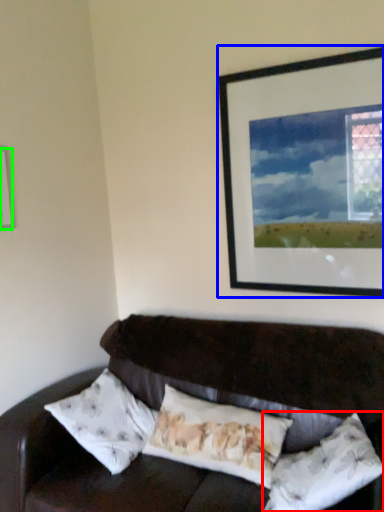
Question: Estimate the real-world distances between objects in this image. Which object is farther from pillow (highlighted by a red box), picture frame (highlighted by a blue box) or picture frame (highlighted by a green box)?

Choices:
 (A) picture frame
 (B) picture frame

Answer: (B)